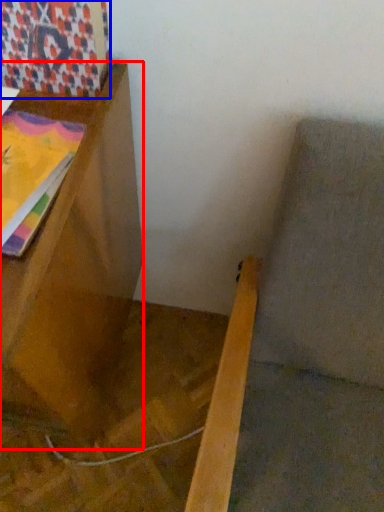
Question: Which point is further to the camera, furniture (highlighted by a red box) or tapestry (highlighted by a blue box)?

Choices:
 (A) furniture
 (B) tapestry

Answer: (B)